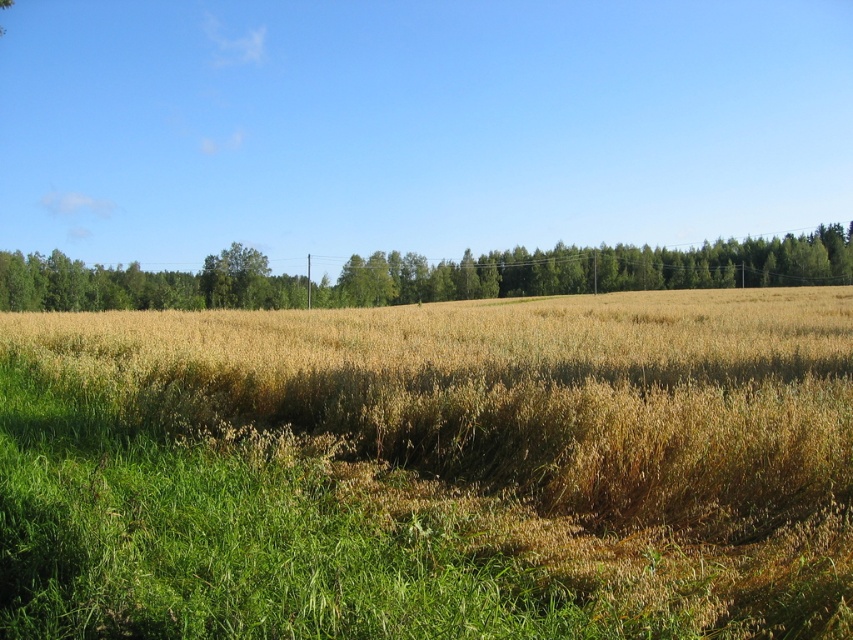
Looking at this image, you are a farmer planning to plant new crops in the field. You have two options for planting areas based on the image you see. One area is where the brown grassy wheat field at center is, and the other is where the green leafy trees at center are. Which area would be more suitable for planting crops that require less space between rows?

The brown grassy wheat field at center is thinner than the green leafy trees at center, so the brown grassy wheat field at center would be more suitable for planting crops that require less space between rows because it has narrower spacing.

You are standing in the middle of the agricultural field and see two points marked on the ground. One is at point [514,324] and the other at point [287,307]. Which point is closer to you?

Point [514,324] is closer to the viewer than point [287,307].

You are a farmer planning to plant new crops in a field. You notice the brown grassy wheat field at center. Based on its location, where should you plant the new crops to ensure they receive maximum sunlight throughout the day?

The brown grassy wheat field at center is located at point (432, 468), so you should plant the new crops to the east of the brown grassy wheat field at center to ensure they receive maximum sunlight throughout the day.